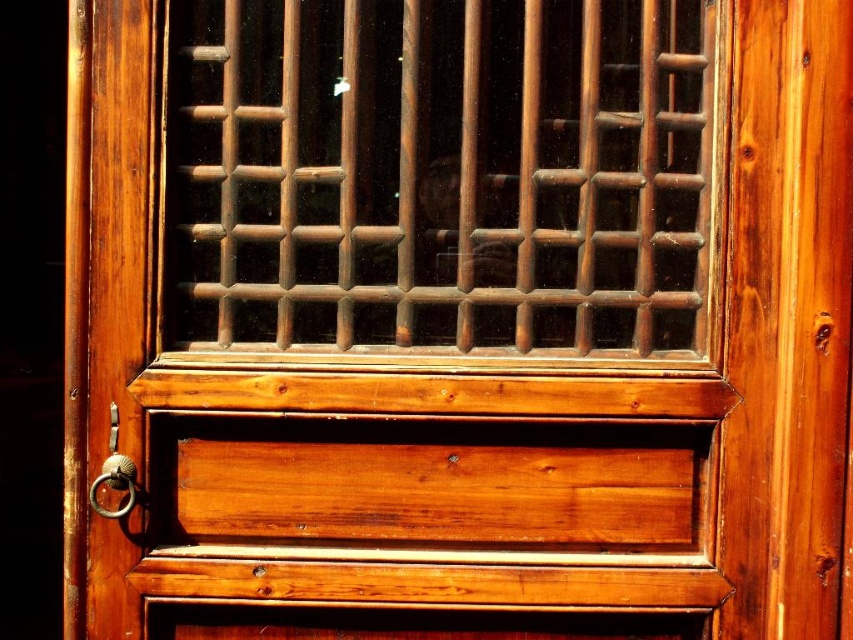
You are standing in front of a wooden door and see the brown wooden grid at center and the polished brass ring at left. Which object is located higher on the door?

The brown wooden grid at center is located higher on the door than the polished brass ring at left.

You are trying to hang a small picture frame that is 10 cm wide. You have two options on the wooden door shown in the scene. Which object, the brown wooden grid at center or the polished brass ring at left, would be more suitable to place the frame next to without it looking too small in comparison?

The brown wooden grid at center has a larger size compared to the polished brass ring at left. Therefore, placing the 10 cm wide picture frame next to the polished brass ring at left would make the frame appear proportionally larger and more balanced in comparison.

Based on the photo, you are a door installer and need to align the brown wooden grid at center and the polished brass ring at left on a new door. Based on the image, which object should be placed to the left of the other?

The polished brass ring at left should be placed to the left of the brown wooden grid at center because the brown wooden grid at center is positioned on the right side of the polished brass ring at left.